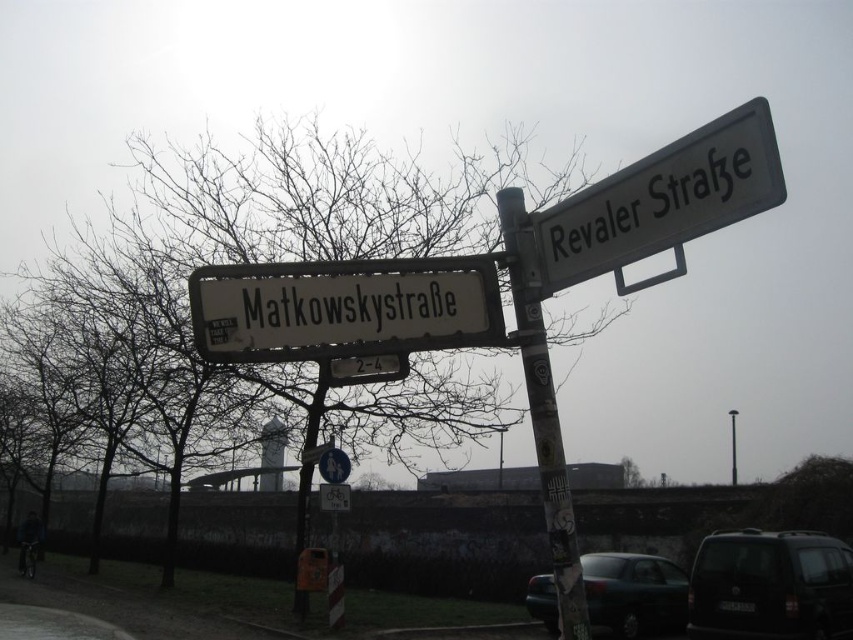
You are a pedestrian standing at the street corner looking at the signposts. Which object is positioned to the left of the other between the stained wood pole at upper center and the metallic pole at upper center?

The stained wood pole at upper center is positioned to the left of the metallic pole at upper center.

Based on the photo, you are a delivery driver trying to read the street signs on a cloudy day. You see the white plastic street sign at upper center and the metallic pole at upper center. Which one is located to the left side?

The white plastic street sign at upper center is to the left of the metallic pole at upper center.

You are a delivery driver trying to read the street signs on the signpost. Which object, the white plastic street sign at upper center or the metallic pole at upper center, would you need to look at more closely because it is smaller?

The white plastic street sign at upper center is smaller than the metallic pole at upper center, so you would need to look at the white plastic street sign at upper center more closely.